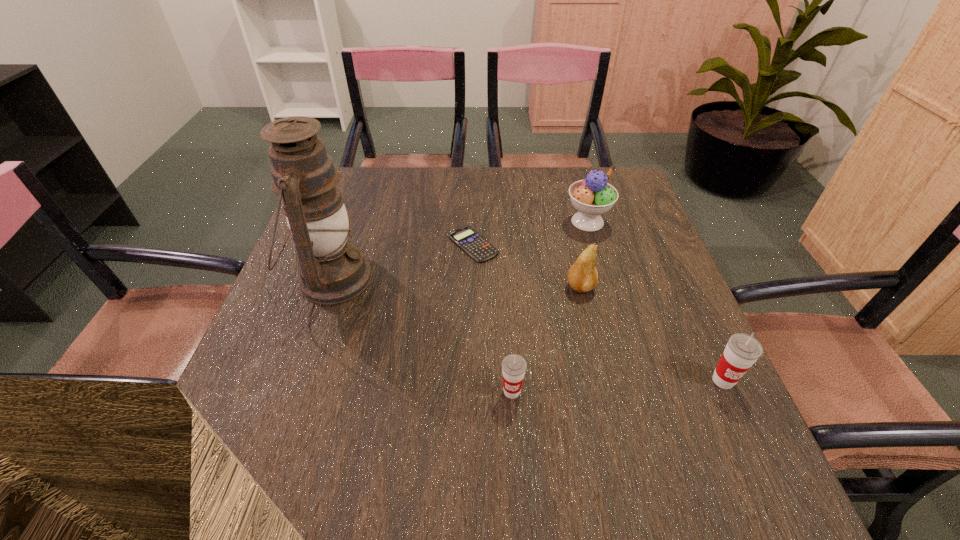
In order to click on vacant space located on the back of the calculator in this screenshot , I will do `click(474, 169)`.

Locate an element on the screen. Image resolution: width=960 pixels, height=540 pixels. blank space located 0.120m on the back of the tallest object is located at coordinates (353, 217).

At what (x,y) coordinates should I click in order to perform the action: click on blank space located on the back of the pear. Please return your answer as a coordinate pair (x, y). Looking at the image, I should click on (568, 233).

The width and height of the screenshot is (960, 540). In order to click on object at the far edge in this screenshot , I will do `click(593, 196)`.

Locate an element on the screen. object present at the near edge is located at coordinates 514,366.

This screenshot has height=540, width=960. What are the coordinates of `object that is at the left edge` in the screenshot? It's located at 332,270.

Identify the location of cup that is at the right edge. (742, 350).

In order to click on icecream present at the right edge in this screenshot , I will do `click(593, 196)`.

Where is `object located at the far right corner`? This screenshot has height=540, width=960. object located at the far right corner is located at coordinates click(x=593, y=196).

At what (x,y) coordinates should I click in order to perform the action: click on vacant space at the far edge of the desktop. Please return your answer as a coordinate pair (x, y). Looking at the image, I should click on (415, 173).